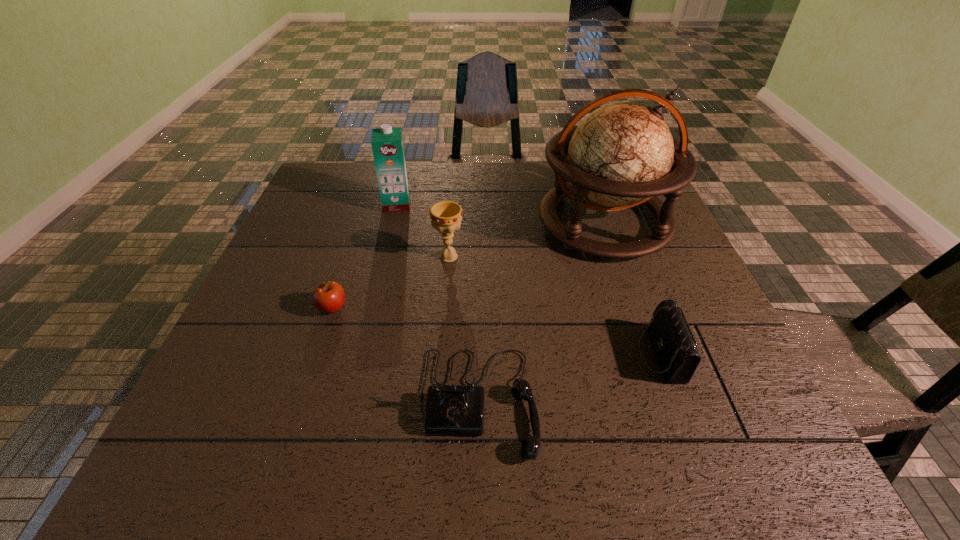
Locate an element on the screen. free space between the telephone and the apple is located at coordinates (405, 355).

Where is `free space between the apple and the telephone`? This screenshot has width=960, height=540. free space between the apple and the telephone is located at coordinates (405, 355).

I want to click on free point between the second tallest object and the leftmost object, so click(x=365, y=256).

Locate an element on the screen. free area in between the tallest object and the clutch bag is located at coordinates (633, 289).

In order to click on vacant area between the second tallest object and the telephone in this screenshot , I will do click(438, 303).

Locate an element on the screen. The image size is (960, 540). free space between the tallest object and the apple is located at coordinates (468, 266).

Locate an element on the screen. object that is the fourth closest to the globe is located at coordinates (387, 144).

What are the coordinates of `object that is the fifth closest to the telephone` in the screenshot? It's located at (387, 144).

I want to click on free spot that satisfies the following two spatial constraints: 1. on the back side of the fourth farthest object; 2. on the left side of the second object from left to right, so click(x=367, y=204).

You are a GUI agent. You are given a task and a screenshot of the screen. Output one action in this format:
    pyautogui.click(x=<x>, y=<y>)
    Task: Click on the free point that satisfies the following two spatial constraints: 1. on the back side of the second object from left to right; 2. on the left side of the apple
    The height and width of the screenshot is (540, 960).
    Given the screenshot: What is the action you would take?
    pos(367,204)